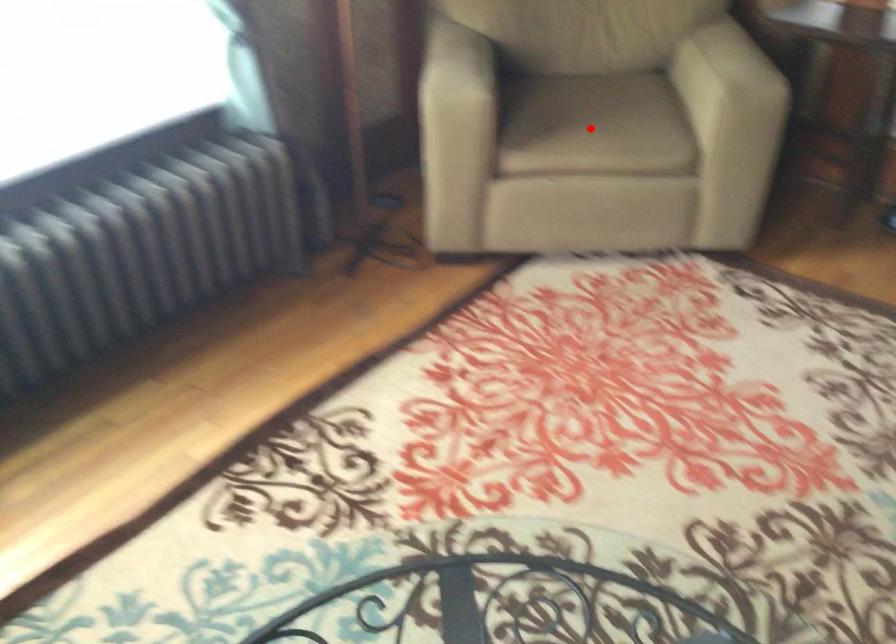
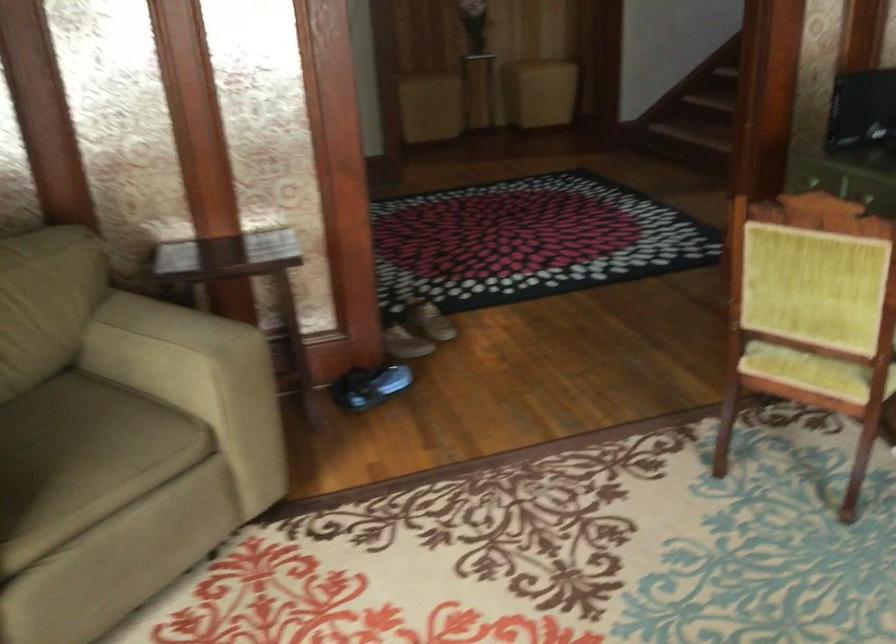
Question: I am providing you with two images of the same scene from different viewpoints. A red point is shown in image1. For the corresponding object point in image2, is it positioned nearer or farther from the camera?

Choices:
 (A) Nearer
 (B) Farther

Answer: (A)